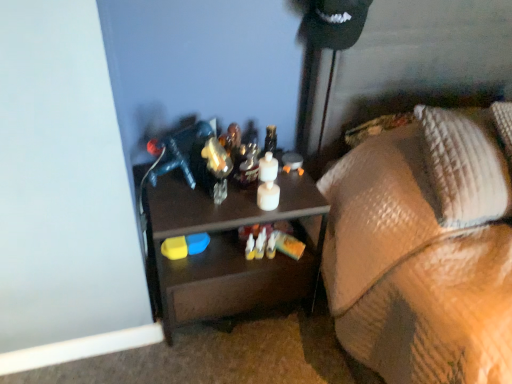
Question: In the image, is textured brown blanket at lower right positioned in front of or behind woven fabric pillow at right?

Choices:
 (A) front
 (B) behind

Answer: (A)

Question: Looking at their shapes, would you say textured brown blanket at lower right is wider or thinner than woven fabric pillow at right?

Choices:
 (A) wide
 (B) thin

Answer: (A)

Question: Which of these objects is positioned closest to the woven fabric pillow at right?

Choices:
 (A) brown matte desk at center
 (B) textured brown blanket at lower right

Answer: (B)

Question: Considering the real-world distances, which object is farthest from the brown matte desk at center?

Choices:
 (A) woven fabric pillow at right
 (B) textured brown blanket at lower right

Answer: (A)